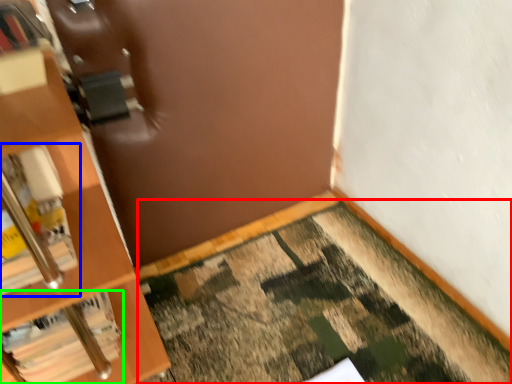
Question: Which object is positioned closest to doormat (highlighted by a red box)? Select from book (highlighted by a blue box) and book (highlighted by a green box).

Choices:
 (A) book
 (B) book

Answer: (B)